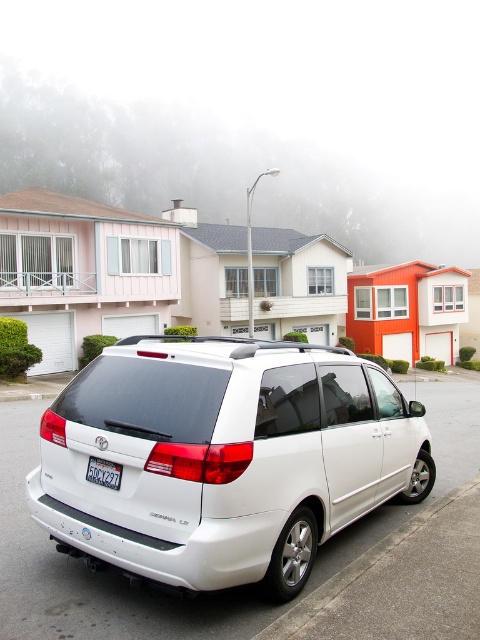
Is white glossy minivan at center further to the viewer compared to gray asphalt curb at lower right?

Yes, it is.

Does white glossy minivan at center appear on the right side of gray asphalt curb at lower right?

No, white glossy minivan at center is not to the right of gray asphalt curb at lower right.

Find the location of `white glossy minivan at center`. white glossy minivan at center is located at coordinates pos(225,458).

Can you confirm if gray asphalt curb at lower right is taller than black plastic license plate at rear?

Correct, gray asphalt curb at lower right is much taller as black plastic license plate at rear.

Is gray asphalt curb at lower right shorter than black plastic license plate at rear?

Incorrect, gray asphalt curb at lower right's height does not fall short of black plastic license plate at rear's.

Between point (393, 552) and point (120, 474), which one is positioned in front?

Point (120, 474) is more forward.

Where is `gray asphalt curb at lower right`? The height and width of the screenshot is (640, 480). gray asphalt curb at lower right is located at coordinates (402, 582).

Who is more distant from viewer, (x=288, y=369) or (x=92, y=461)?

Point (x=288, y=369)

The width and height of the screenshot is (480, 640). What do you see at coordinates (225, 458) in the screenshot?
I see `white glossy minivan at center` at bounding box center [225, 458].

Who is more distant from viewer, (431, 477) or (106, 472)?

The point (431, 477) is more distant.

You are a GUI agent. You are given a task and a screenshot of the screen. Output one action in this format:
    pyautogui.click(x=<x>, y=<y>)
    Task: Click on the white glossy minivan at center
    Image resolution: width=480 pixels, height=640 pixels.
    Given the screenshot: What is the action you would take?
    pyautogui.click(x=225, y=458)